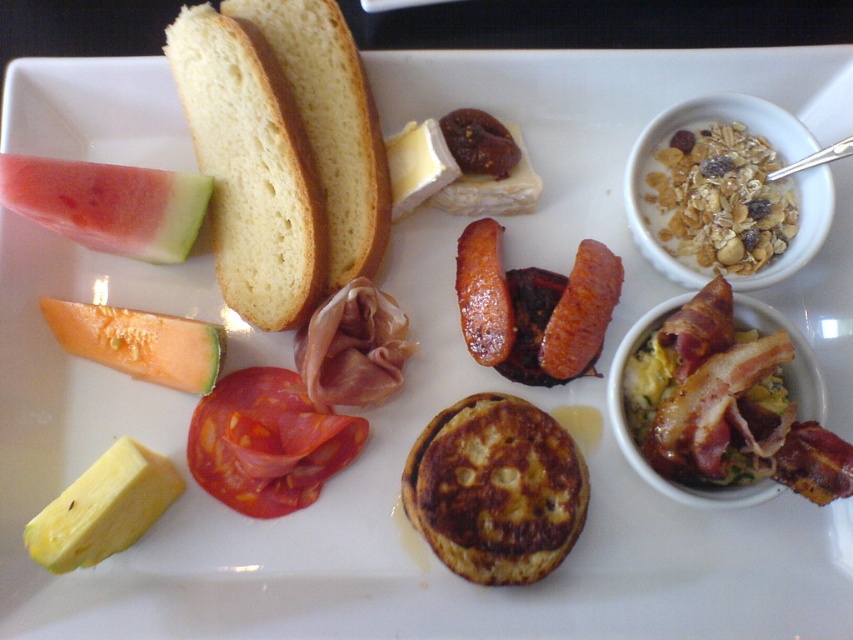
Looking at this image, you are arranging a charcuterie platter and want to place a new item between the golden brown crusty bread at upper left and the white creamy cheese at center. Is there space for it?

The golden brown crusty bread at upper left is to the left of white creamy cheese at center, so there is space between them to place the new item.